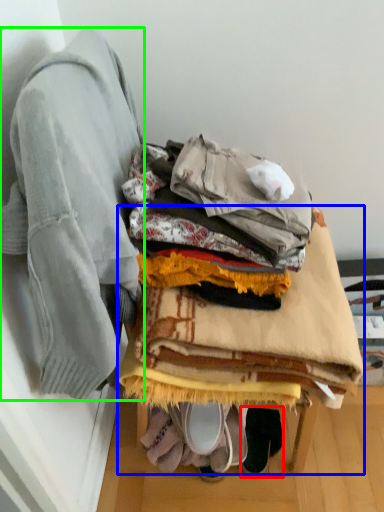
Question: Considering the real-world distances, which object is farthest from footwear (highlighted by a red box)? furniture (highlighted by a blue box) or jacket (highlighted by a green box)?

Choices:
 (A) furniture
 (B) jacket

Answer: (B)